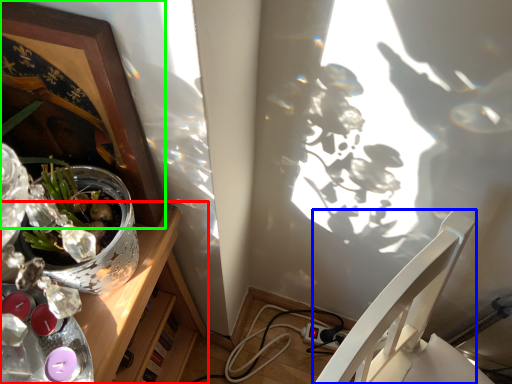
Question: Which is nearer to the desk (highlighted by a red box)? chair (highlighted by a blue box) or picture frame (highlighted by a green box).

Choices:
 (A) chair
 (B) picture frame

Answer: (B)